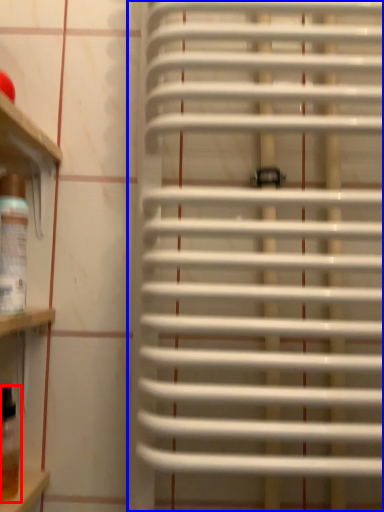
Question: Which point is closer to the camera, wine bottle (highlighted by a red box) or window blind (highlighted by a blue box)?

Choices:
 (A) wine bottle
 (B) window blind

Answer: (B)